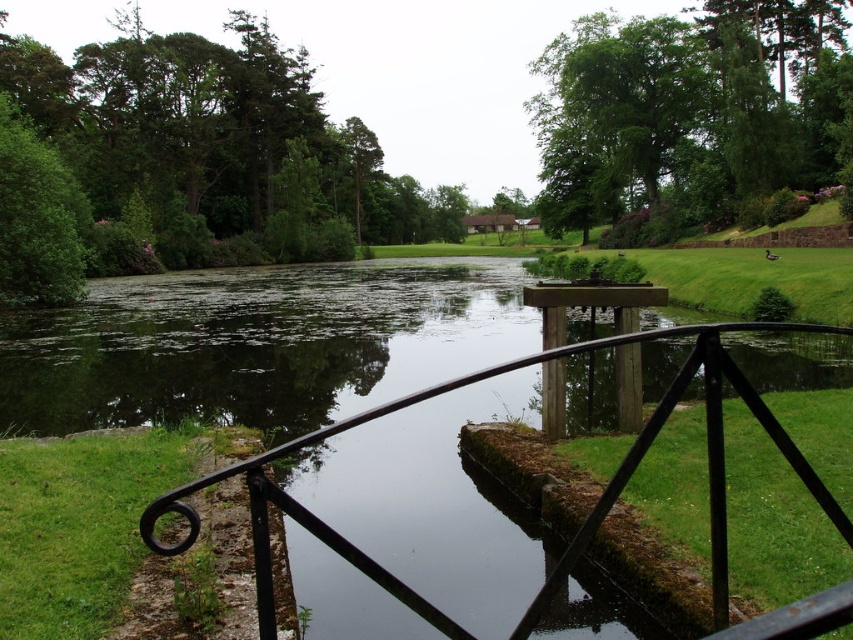
Question: Estimate the real-world distances between objects in this image. Which object is farther from the black wrought iron rail at center?

Choices:
 (A) green leafy tree at upper center
 (B) green leafy tree at upper left

Answer: (A)

Question: Does green leafy tree at upper center have a smaller size compared to black wrought iron rail at center?

Choices:
 (A) no
 (B) yes

Answer: (A)

Question: Is green leafy tree at upper center wider than black wrought iron rail at center?

Choices:
 (A) no
 (B) yes

Answer: (B)

Question: Estimate the real-world distances between objects in this image. Which object is closer to the black wrought iron rail at center?

Choices:
 (A) green leafy tree at upper center
 (B) green leafy tree at upper left

Answer: (B)

Question: Does green leafy tree at upper center lie behind green leafy tree at upper left?

Choices:
 (A) no
 (B) yes

Answer: (B)

Question: Which point is farther to the camera?

Choices:
 (A) (776, 426)
 (B) (39, 148)
 (C) (669, 208)

Answer: (C)